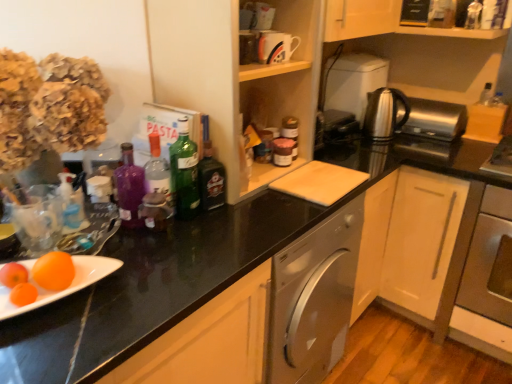
Question: Considering the relative sizes of orange matte at lower left and green glass bottle at center, which ranks as the 2th bottle in right-to-left order, in the image provided, is orange matte at lower left taller than green glass bottle at center, which ranks as the 2th bottle in right-to-left order,?

Choices:
 (A) yes
 (B) no

Answer: (B)

Question: From a real-world perspective, is orange matte at lower left positioned under green glass bottle at center, which ranks as the 2th bottle in right-to-left order, based on gravity?

Choices:
 (A) yes
 (B) no

Answer: (A)

Question: Is orange matte at lower left aimed at green glass bottle at center, which is the 3th bottle in left-to-right order?

Choices:
 (A) yes
 (B) no

Answer: (B)

Question: Does orange matte at lower left appear on the left side of green glass bottle at center, which is the 3th bottle in left-to-right order?

Choices:
 (A) no
 (B) yes

Answer: (B)

Question: Considering the relative sizes of orange matte at lower left and green glass bottle at center, which ranks as the 2th bottle in right-to-left order, in the image provided, is orange matte at lower left thinner than green glass bottle at center, which ranks as the 2th bottle in right-to-left order,?

Choices:
 (A) no
 (B) yes

Answer: (A)

Question: From a real-world perspective, is purple glass bottle at center, which is the 4th bottle in right-to-left order, above or below satin silver kettle at upper right, marked as the 2th appliance in a left-to-right arrangement?

Choices:
 (A) above
 (B) below

Answer: (B)

Question: From the image's perspective, is purple glass bottle at center, which is the 4th bottle in right-to-left order, above or below satin silver kettle at upper right, the second appliance when ordered from right to left?

Choices:
 (A) below
 (B) above

Answer: (A)

Question: Looking at their shapes, would you say purple glass bottle at center, which is the 4th bottle in right-to-left order, is wider or thinner than satin silver kettle at upper right, the first appliance in the back-to-front sequence?

Choices:
 (A) wide
 (B) thin

Answer: (B)

Question: Relative to satin silver kettle at upper right, the third appliance in the front-to-back sequence, is purple glass bottle at center, which is the 4th bottle in right-to-left order, in front or behind?

Choices:
 (A) behind
 (B) front

Answer: (B)

Question: Is stainless steel oven at lower right in front of or behind dark green glass bottle at center, acting as the 4th bottle starting from the left, in the image?

Choices:
 (A) front
 (B) behind

Answer: (B)

Question: Is stainless steel oven at lower right bigger or smaller than dark green glass bottle at center, arranged as the 1th bottle when viewed from the right?

Choices:
 (A) big
 (B) small

Answer: (A)

Question: From the image's perspective, is stainless steel oven at lower right located above or below dark green glass bottle at center, arranged as the 1th bottle when viewed from the right?

Choices:
 (A) above
 (B) below

Answer: (B)

Question: From a real-world perspective, relative to dark green glass bottle at center, acting as the 4th bottle starting from the left, is stainless steel oven at lower right vertically above or below?

Choices:
 (A) above
 (B) below

Answer: (B)

Question: From the image's perspective, is purple glass bottle at center, which is the 4th bottle in right-to-left order, located above or below satin silver toaster at upper right, which is the 3th appliance from left to right?

Choices:
 (A) below
 (B) above

Answer: (A)

Question: Is point (129, 215) closer or farther from the camera than point (415, 105)?

Choices:
 (A) farther
 (B) closer

Answer: (B)